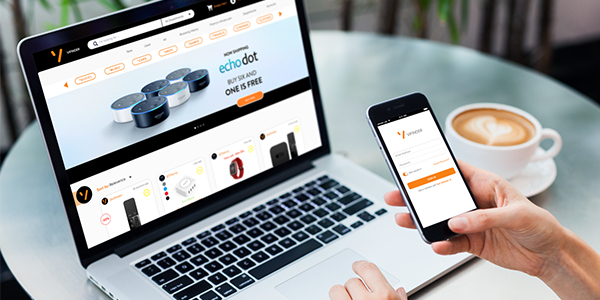
Identify the location of window. (370, 15).